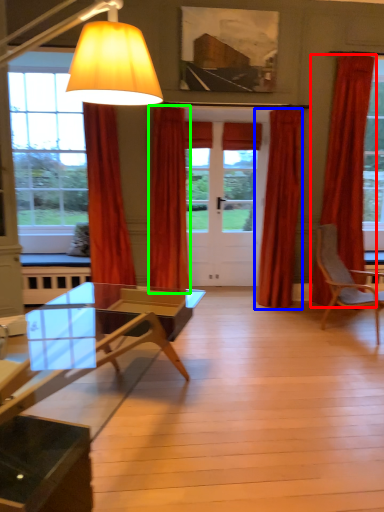
Question: Which object is positioned farthest from curtain (highlighted by a red box)? Select from curtain (highlighted by a blue box) and curtain (highlighted by a green box).

Choices:
 (A) curtain
 (B) curtain

Answer: (B)